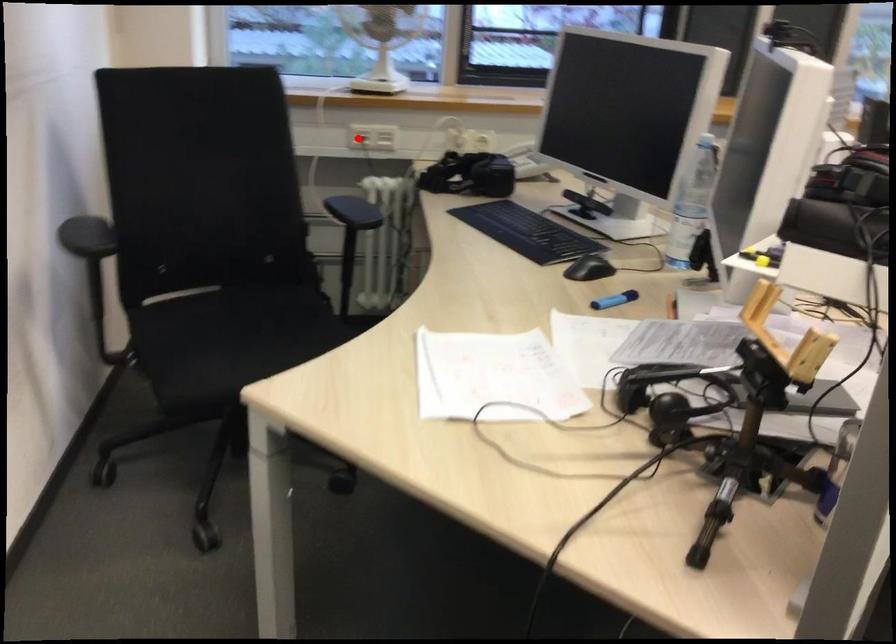
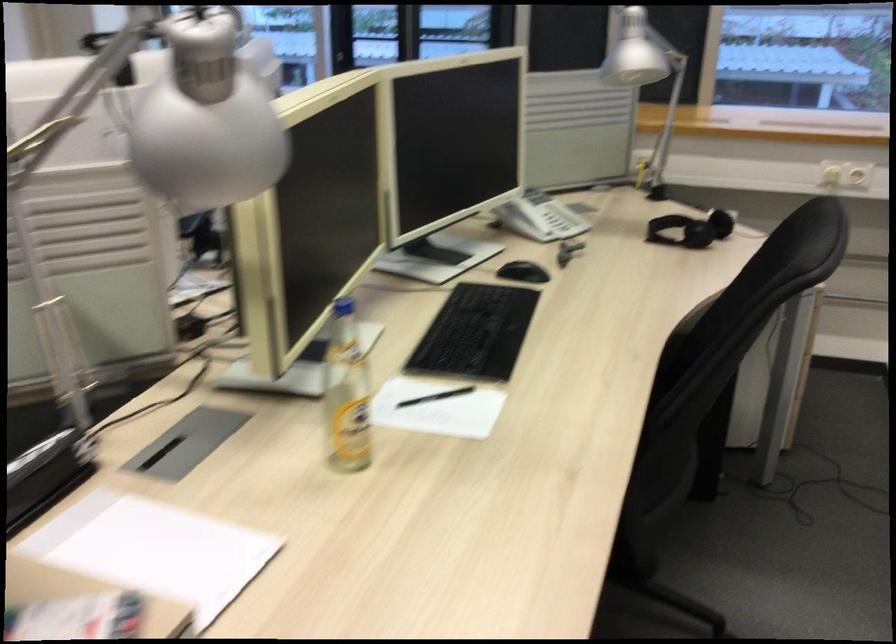
Question: I am providing you with two images of the same scene from different viewpoints. A red point is marked on the first image. Can you still see the location of the red point in image 2?

Choices:
 (A) Yes
 (B) No

Answer: (B)